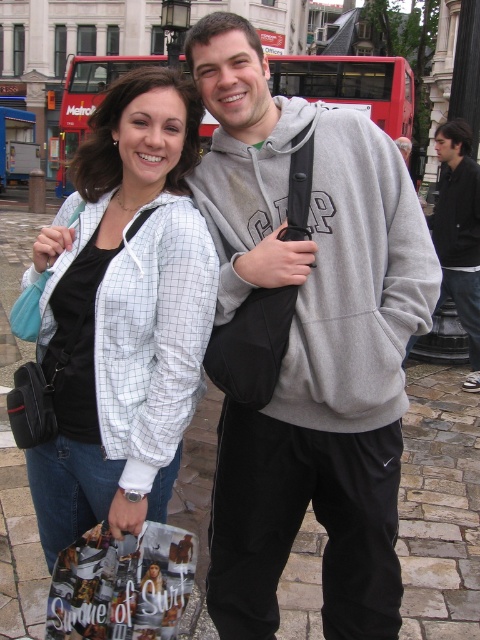
You are a photographer trying to capture both the white checkered jacket at upper left and the black cotton hoodie at center in a single frame. Given their sizes in the image, which one would you need to position closer to the camera to ensure both fit within the frame?

Since the white checkered jacket at upper left occupies less space than the black cotton hoodie at center, you should position the black cotton hoodie at center closer to the camera to ensure both fit within the frame.